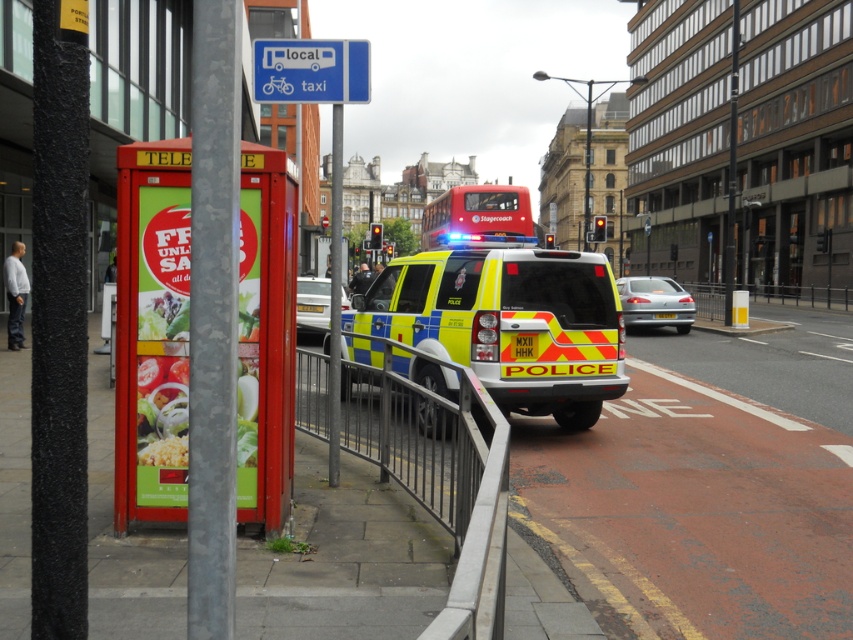
You are a pedestrian standing on the sidewalk and want to cross the road. The metallic gray railing at center separates the sidewalk from the road. Is the white glossy sedan at center blocking your path to the railing?

The metallic gray railing at center is located below the white glossy sedan at center, so the sedan is positioned above the railing. Since the railing is on the sidewalk side, the sedan is not blocking your path to the railing.

You are standing at the point with coordinates (152, 332) in the image. What object are you currently standing on?

The point with coordinates (152, 332) is located on the red plastic telephone booth at left.